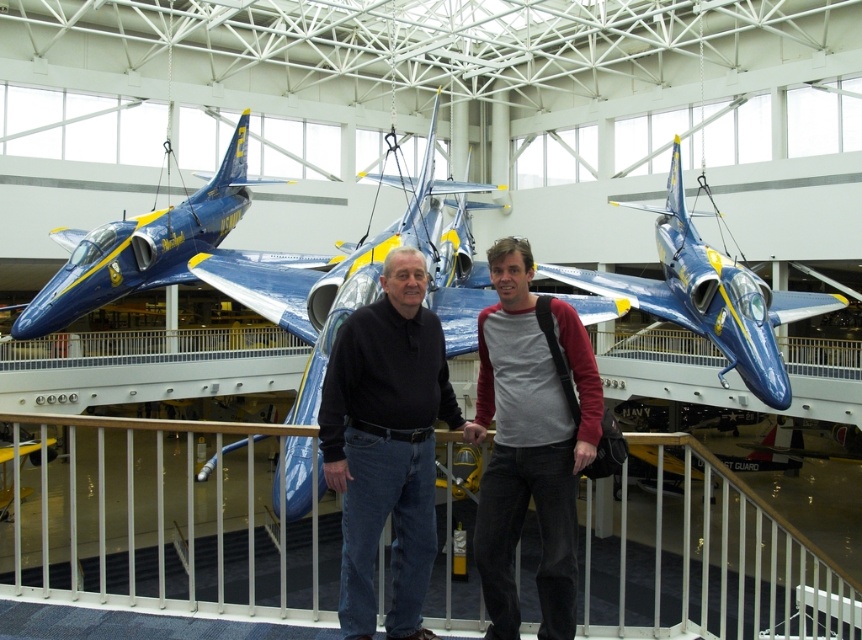
Can you confirm if gray cotton t-shirt at center is positioned to the left of shiny blue airplane at center?

No, gray cotton t-shirt at center is not to the left of shiny blue airplane at center.

Is point (478, 545) closer to viewer compared to point (44, 301)?

That is True.

The image size is (862, 640). In order to click on gray cotton t-shirt at center in this screenshot , I will do `click(529, 444)`.

Who is lower down, shiny blue jet at center or shiny blue airplane at center?

shiny blue jet at center is lower down.

Who is higher up, shiny blue jet at center or shiny blue airplane at center?

shiny blue airplane at center is higher up.

What do you see at coordinates (709, 296) in the screenshot?
I see `shiny blue jet at center` at bounding box center [709, 296].

At what (x,y) coordinates should I click in order to perform the action: click on shiny blue jet at center. Please return your answer as a coordinate pair (x, y). Looking at the image, I should click on (709, 296).

Which is above, white metal railing at lower center or gray cotton t-shirt at center?

gray cotton t-shirt at center

Is white metal railing at lower center positioned before gray cotton t-shirt at center?

No, it is not.

Locate an element on the screen. This screenshot has height=640, width=862. white metal railing at lower center is located at coordinates (161, 518).